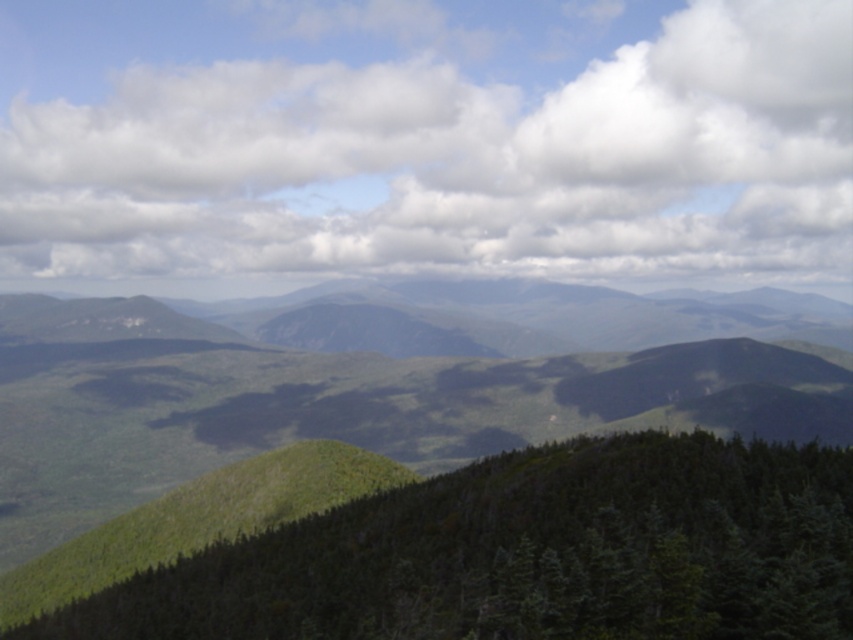
You are standing in the mountain landscape and want to determine which of the two points, point (135, 67) or point (543, 449), is closer to you. Based on the scene, which one would you say is nearer?

Point (135, 67) is closer to you because it is further to the camera than point (543, 449).

You are an airplane pilot flying over the mountainous landscape. You notice a white fluffy cloud at upper center and a green matte tree at center. Which object is wider from your perspective?

The white fluffy cloud at upper center might be wider than the green matte tree at center.

You are an airplane passenger looking out the window and see the white fluffy cloud at upper center and the green matte tree at center. Which object is closer to the airplane?

The white fluffy cloud at upper center is closer to the airplane because the green matte tree at center is behind it.